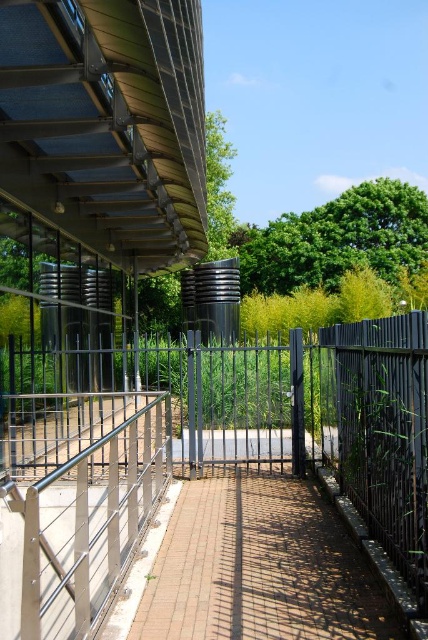
Is point (362, 413) positioned behind point (67, 536)?

No, (362, 413) is in front of (67, 536).

Which is behind, point (95, 573) or point (50, 589)?

Positioned behind is point (95, 573).

At what (x,y) coordinates should I click in order to perform the action: click on black metal fence at center. Please return your answer as a coordinate pair (x, y). This screenshot has width=428, height=640. Looking at the image, I should click on (210, 456).

Which is behind, point (41, 518) or point (350, 598)?

The point (41, 518) is behind.

Who is shorter, black metal fence at center or brick paved path at center?

brick paved path at center

Where is `black metal fence at center`? The height and width of the screenshot is (640, 428). black metal fence at center is located at coordinates coord(210,456).

The image size is (428, 640). Find the location of `black metal fence at center`. black metal fence at center is located at coordinates (210, 456).

Is point (312, 509) closer to viewer compared to point (62, 547)?

Yes, it is.

Can you confirm if brick paved path at center is positioned below satin silver railing at lower left?

No, brick paved path at center is not below satin silver railing at lower left.

Which is behind, point (214, 620) or point (30, 588)?

Point (214, 620)

Locate an element on the screen. Image resolution: width=428 pixels, height=640 pixels. brick paved path at center is located at coordinates (258, 566).